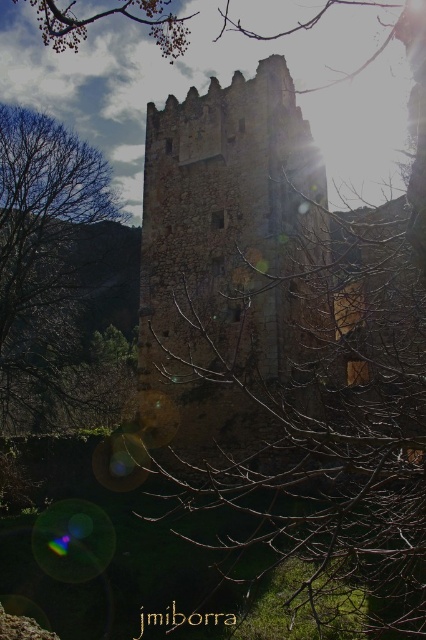
You are standing in front of the historic stone tower and notice two points marked on the image. The first point is at coordinate point (x=232, y=305) and the second is at coordinate point (x=43, y=356). Which point is closer to you as you face the tower?

Point (x=232, y=305) is in front of point (x=43, y=356), so it is closer to you as you face the tower.

You are an architect examining the historic stone tower at center and the brown leafless tree at left. Based on their sizes, which object would cast a larger shadow during midday when the sun is directly overhead?

The stone tower at center is bigger than the brown leafless tree at left, so it would cast a larger shadow during midday when the sun is directly overhead.

You are an architect examining the historic stone tower at center and the brown leafless tree at left. Which structure appears taller in the image?

The brown leafless tree at left is taller than the stone tower at center.